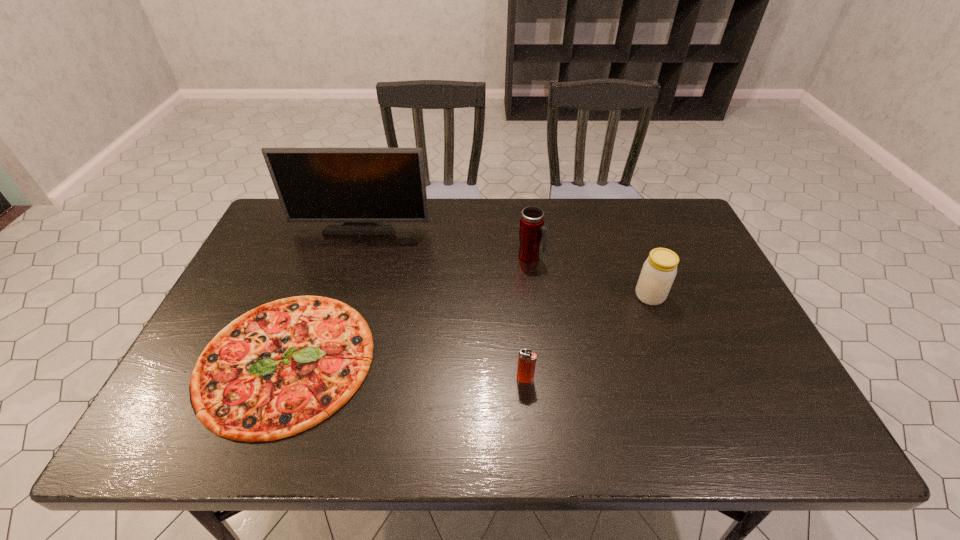
At what (x,y) coordinates should I click in order to perform the action: click on monitor. Please return your answer as a coordinate pair (x, y). The image size is (960, 540). Looking at the image, I should click on [360, 190].

The image size is (960, 540). In order to click on the tallest object in this screenshot , I will do `click(360, 190)`.

At what (x,y) coordinates should I click in order to perform the action: click on the fourth nearest object. Please return your answer as a coordinate pair (x, y). Looking at the image, I should click on (532, 230).

Identify the location of the rightmost object. This screenshot has height=540, width=960. (659, 270).

Find the location of a particular element. the fourth tallest object is located at coordinates (527, 359).

This screenshot has width=960, height=540. Identify the location of pizza. (279, 369).

Where is `free location located 0.320m on the screen side of the tallest object`? This screenshot has height=540, width=960. free location located 0.320m on the screen side of the tallest object is located at coordinates (335, 309).

Find the location of a particular element. This screenshot has height=540, width=960. free space located on the side with the handle of the thermos bottle is located at coordinates (666, 258).

Where is `vacant space located on the back of the jar`? The image size is (960, 540). vacant space located on the back of the jar is located at coordinates (618, 212).

The height and width of the screenshot is (540, 960). What are the coordinates of `free point located on the left of the igniter` in the screenshot? It's located at (344, 380).